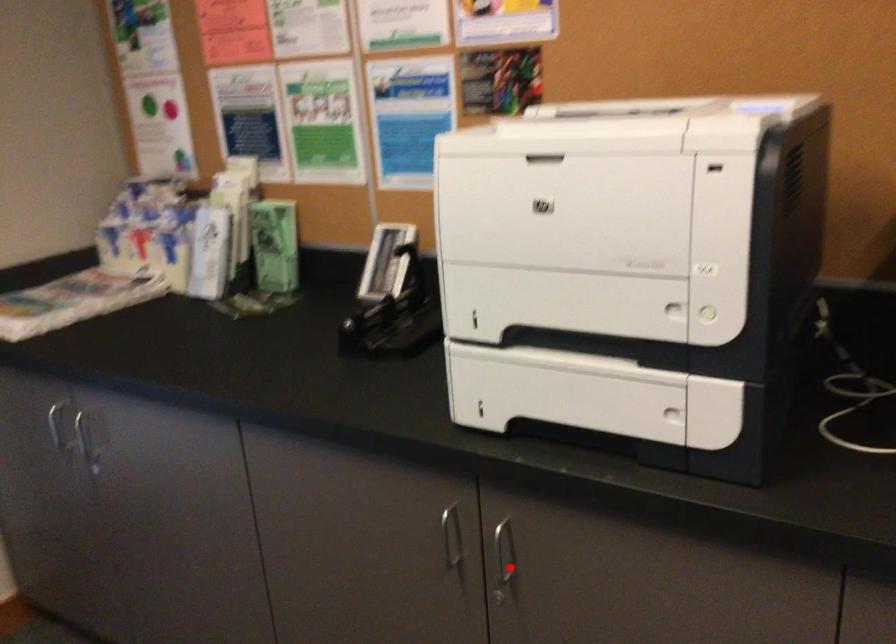
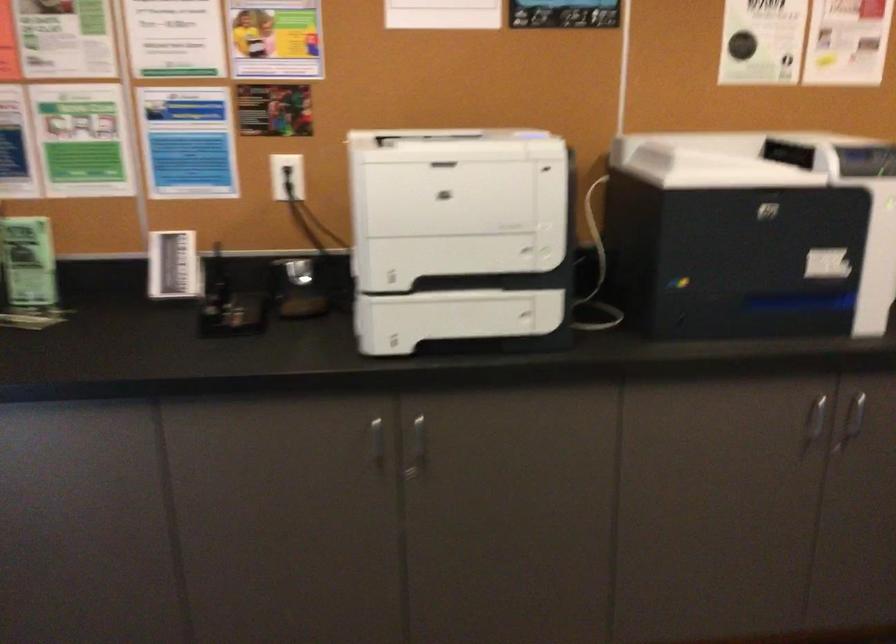
Question: I am providing you with two images of the same scene from different viewpoints. Given a red point in image1, look at the same physical point in image2. Is it:

Choices:
 (A) Closer to the viewpoint
 (B) Farther from the viewpoint

Answer: (B)